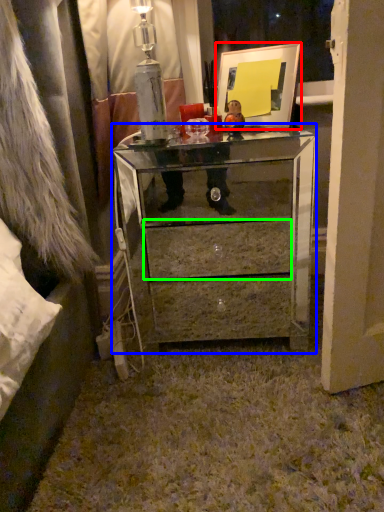
Question: Based on their relative distances, which object is nearer to picture frame (highlighted by a red box)? Choose from chest of drawers (highlighted by a blue box) and drawer (highlighted by a green box).

Choices:
 (A) chest of drawers
 (B) drawer

Answer: (A)